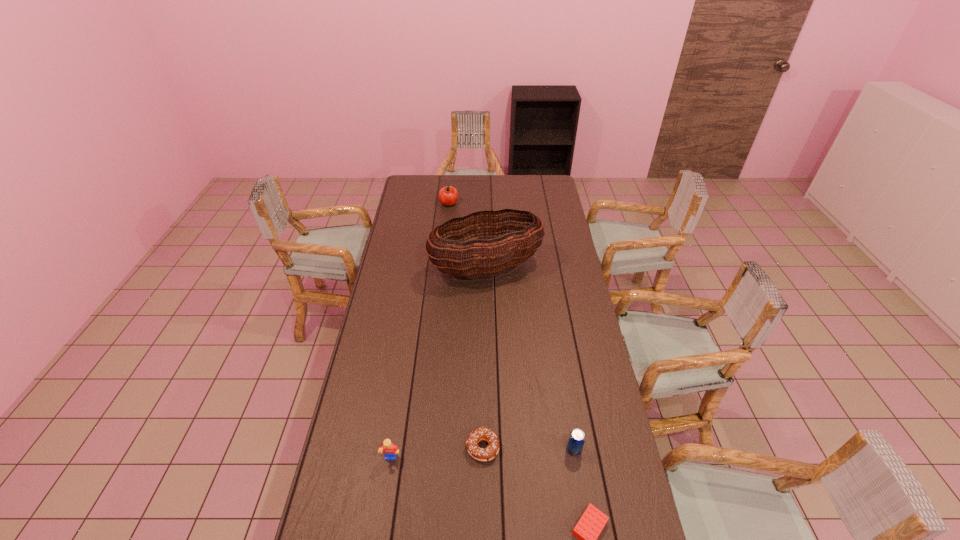
Identify the location of free space located on the back of the beer can. [569, 422].

Find the location of a particular element. This screenshot has height=540, width=960. vacant space located 0.180m on the right of the doughnut is located at coordinates (556, 447).

The image size is (960, 540). I want to click on object positioned at the left edge, so click(389, 450).

Where is `basket present at the right edge`? basket present at the right edge is located at coordinates (475, 257).

Find the location of a particular element. beer can that is at the right edge is located at coordinates (576, 440).

This screenshot has width=960, height=540. I want to click on vacant space at the far edge of the desktop, so click(x=475, y=176).

Find the location of a particular element. free point at the left edge is located at coordinates (378, 300).

At what (x,y) coordinates should I click in order to perform the action: click on vacant space at the right edge. Please return your answer as a coordinate pair (x, y). The width and height of the screenshot is (960, 540). Looking at the image, I should click on (551, 222).

The image size is (960, 540). What are the coordinates of `free space between the beer can and the second shortest object` in the screenshot? It's located at (528, 448).

I want to click on vacant space that is in between the leftmost object and the second shortest object, so click(x=437, y=454).